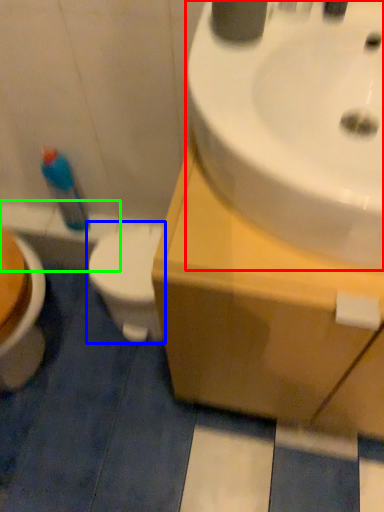
Question: Which object is the farthest from sink (highlighted by a red box)? Choose among these: toilet (highlighted by a blue box) or bath (highlighted by a green box).

Choices:
 (A) toilet
 (B) bath

Answer: (B)